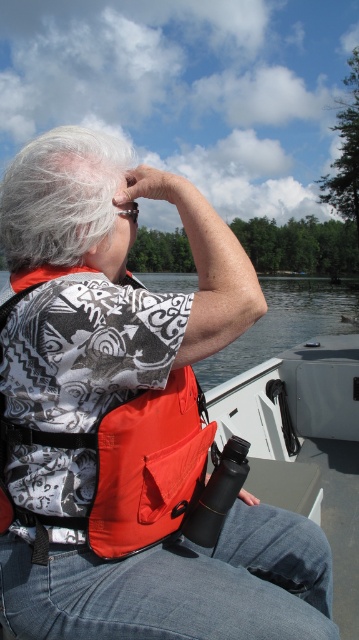
Question: Can you confirm if orange fabric life jacket at center is bigger than white fluffy hair at upper left?

Choices:
 (A) yes
 (B) no

Answer: (B)

Question: In this image, where is orange fabric life jacket at center located relative to white fluffy hair at upper left?

Choices:
 (A) left
 (B) right

Answer: (B)

Question: Does orange fabric life jacket at center appear on the right side of white fluffy hair at upper left?

Choices:
 (A) no
 (B) yes

Answer: (B)

Question: Which point is closer to the camera?

Choices:
 (A) white fluffy hair at upper left
 (B) orange fabric life jacket at center

Answer: (B)